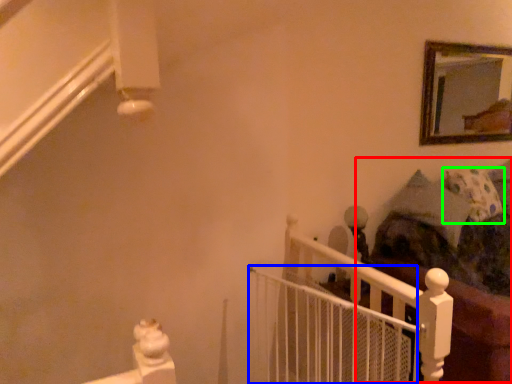
Question: Which is farther away from bed (highlighted by a red box)? balustrade (highlighted by a blue box) or pillow (highlighted by a green box)?

Choices:
 (A) balustrade
 (B) pillow

Answer: (A)